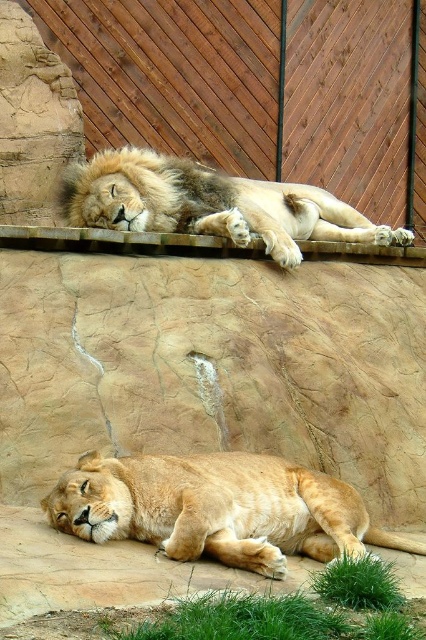
You are a zookeeper who needs to ensure that both lions have enough space in their enclosure. Given that the golden fur lion at upper center is taller than the golden fur lion at lower center, which lion requires a higher platform to accommodate its height?

The golden fur lion at upper center requires a higher platform because it is taller than the golden fur lion at lower center.

You are a zookeeper trying to feed the golden fur lion at lower center through the wooden fence at upper center. Can you reach the lion with a food tray that extends 1 meter from your position outside the fence?

The golden fur lion at lower center is behind the wooden fence at upper center, so the fence blocks direct access. You cannot reach the lion with a 1 meter tray unless the fence has an opening or gap large enough to pass the tray through.

You are a zookeeper who needs to ensure the wooden fence at upper center is visible to visitors. Since the golden fur lion at lower center is blocking part of the fence, can you estimate whether the fence is still mostly visible based on their sizes?

The wooden fence at upper center is larger in size than the golden fur lion at lower center, so even if the lion is blocking part of it, the fence should still be mostly visible.